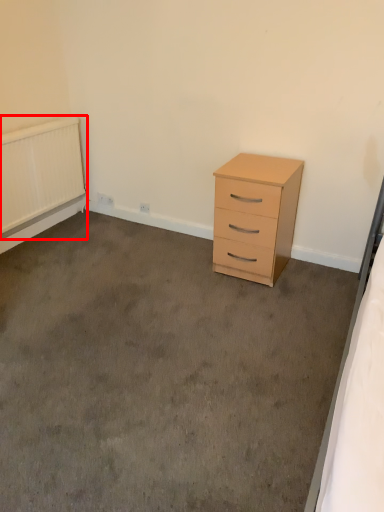
Question: From the image's perspective, where is radiator (annotated by the red box) located relative to chest of drawers?

Choices:
 (A) below
 (B) above

Answer: (B)